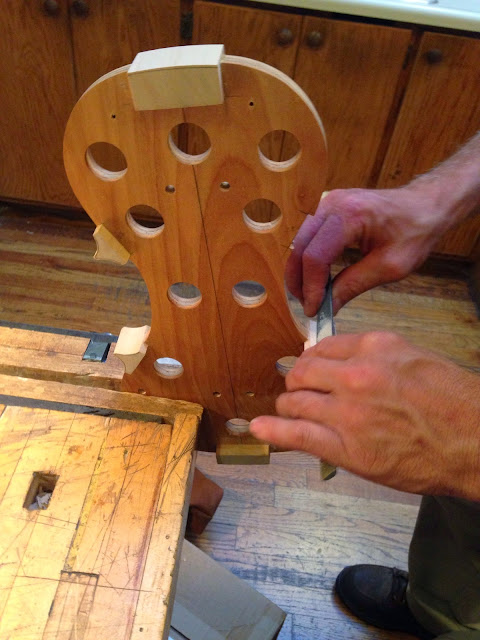
Where is `floor`? floor is located at coordinates (284, 554).